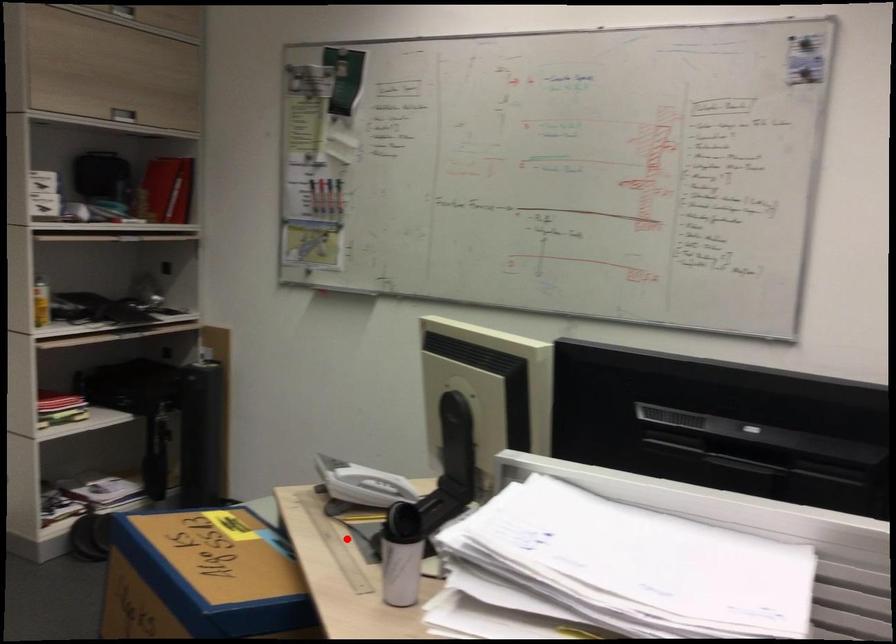
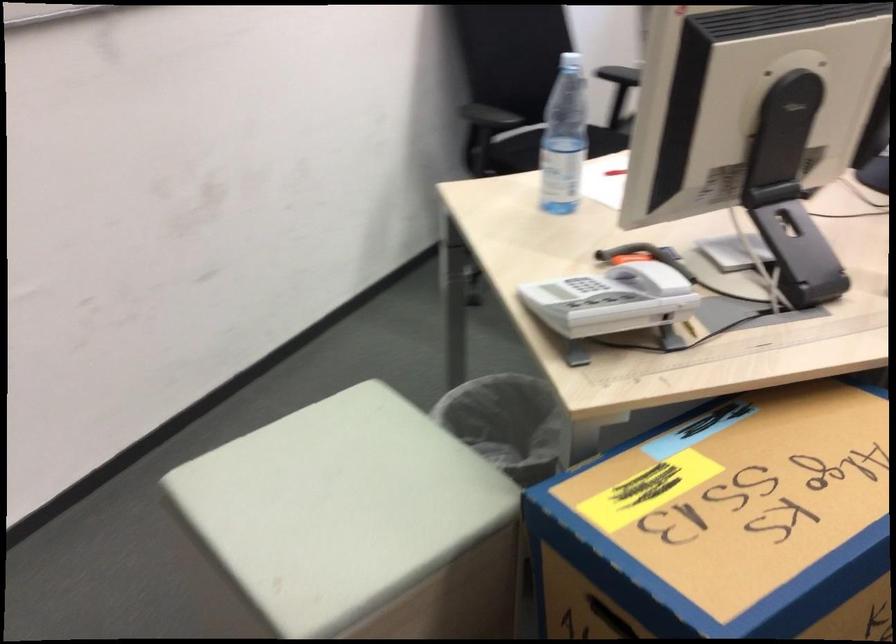
Where in the second image is the point corresponding to the highlighted location from the first image?

(746, 334)